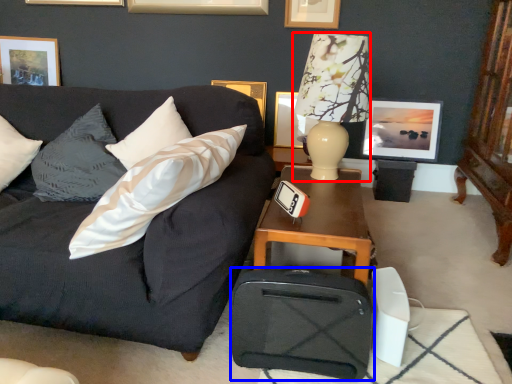
Question: Which point is further to the camera, table lamp (highlighted by a red box) or luggage (highlighted by a blue box)?

Choices:
 (A) table lamp
 (B) luggage

Answer: (A)